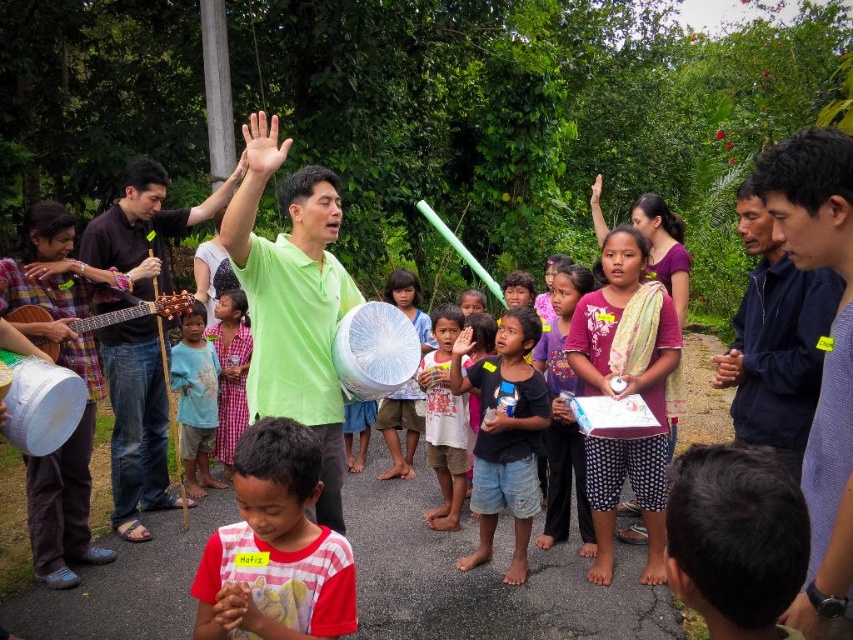
You are standing at the point with coordinates point (723, 577) and want to move towards the point with coordinates point (838, 600). Which direction should you move to get closer to your destination?

Since point (838, 600) is further to the viewer than point (723, 577), you should move forward to get closer to your destination.

You are a photographer at the event and want to capture a photo that includes both the brown hair at lower right and the dark brown leather guitar at left. Which object should you focus on first to ensure both are in sharp focus?

You should focus on the brown hair at lower right first because it is closer to the viewer than the dark brown leather guitar at left. By focusing on the closer object, the depth of field may also keep the farther object in acceptable focus.